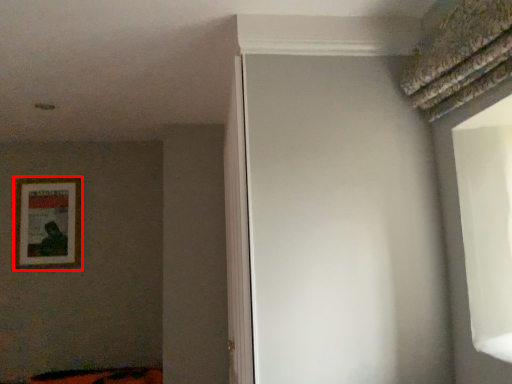
Question: From the image's perspective, where is picture frame (annotated by the red box) located in relation to screen door in the image?

Choices:
 (A) above
 (B) below

Answer: (A)